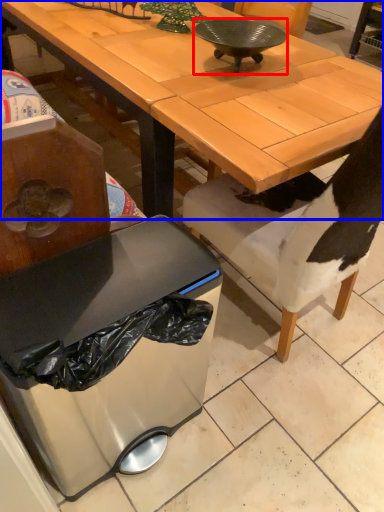
Question: Which object is further to the camera taking this photo, bowl (highlighted by a red box) or desk (highlighted by a blue box)?

Choices:
 (A) bowl
 (B) desk

Answer: (A)